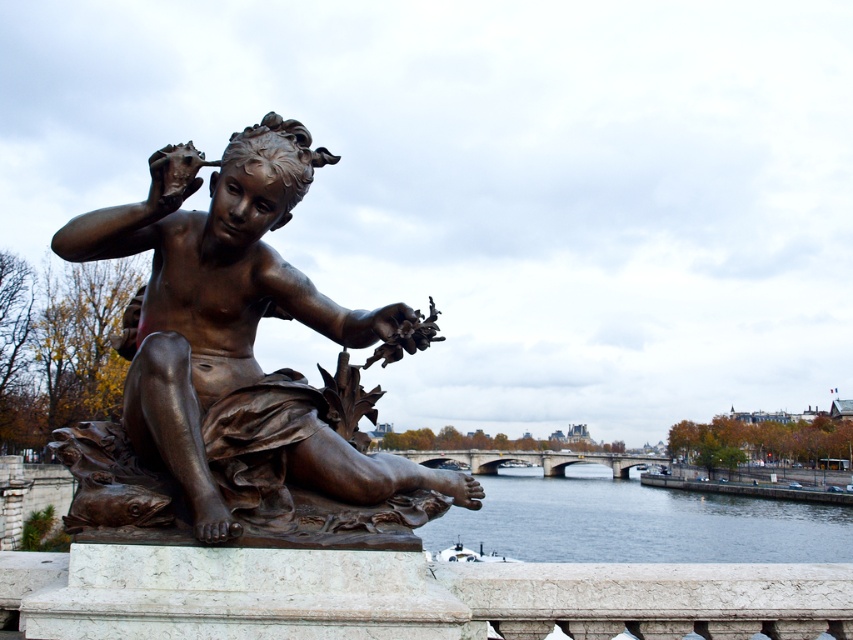
Question: Considering the relative positions of bronze statue at center and dark blue water at lower center in the image provided, where is bronze statue at center located with respect to dark blue water at lower center?

Choices:
 (A) left
 (B) right

Answer: (A)

Question: Can you confirm if bronze statue at center is bigger than dark blue water at lower center?

Choices:
 (A) yes
 (B) no

Answer: (B)

Question: Is the position of bronze statue at center less distant than that of dark blue water at lower center?

Choices:
 (A) no
 (B) yes

Answer: (B)

Question: Which point is farther from the camera taking this photo?

Choices:
 (A) (369, 419)
 (B) (752, 509)

Answer: (B)

Question: Among these objects, which one is nearest to the camera?

Choices:
 (A) dark blue water at lower center
 (B) bronze statue at center

Answer: (B)